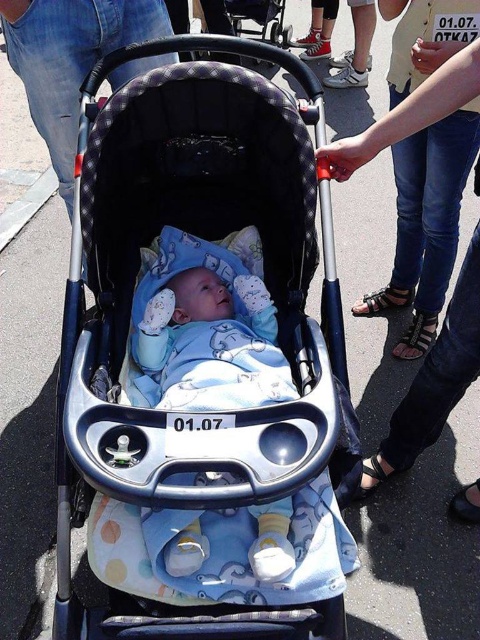
Question: Is blue soft fabric baby at center below blue denim jeans at upper right?

Choices:
 (A) no
 (B) yes

Answer: (B)

Question: Which point appears closest to the camera in this image?

Choices:
 (A) (456, 305)
 (B) (101, 556)
 (C) (193, 364)

Answer: (B)

Question: Which object appears closest to the camera in this image?

Choices:
 (A) blue denim jeans at upper right
 (B) blue soft fabric baby at center

Answer: (B)

Question: Is matte blue fabric baby carriage at center further to the viewer compared to blue denim jeans at upper right?

Choices:
 (A) no
 (B) yes

Answer: (A)

Question: Is matte blue fabric baby carriage at center positioned in front of blue denim jeans at upper right?

Choices:
 (A) no
 (B) yes

Answer: (B)

Question: Which object is farther from the camera taking this photo?

Choices:
 (A) matte blue fabric baby carriage at center
 (B) blue soft fabric baby at center

Answer: (B)